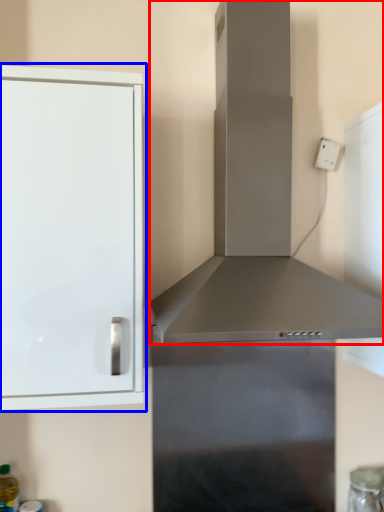
Question: Which object appears closest to the camera in this image, vent (highlighted by a red box) or cabinetry (highlighted by a blue box)?

Choices:
 (A) vent
 (B) cabinetry

Answer: (A)